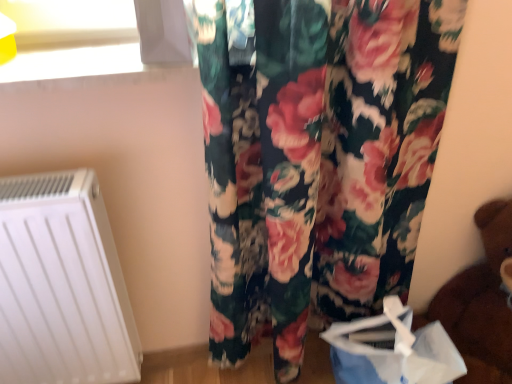
This screenshot has height=384, width=512. I want to click on white matte radiator at lower left, so click(x=62, y=285).

What are the coordinates of `blue paper bag at lower right` in the screenshot? It's located at (392, 350).

Locate an element on the screen. The height and width of the screenshot is (384, 512). white matte radiator at lower left is located at coordinates (62, 285).

Is white matte radiator at lower left positioned beyond the bounds of blue paper bag at lower right?

Absolutely, white matte radiator at lower left is external to blue paper bag at lower right.

How different are the orientations of white matte radiator at lower left and blue paper bag at lower right in degrees?

white matte radiator at lower left and blue paper bag at lower right are facing 1.56e-05 degrees away from each other.

Based on the photo, is white matte radiator at lower left far from blue paper bag at lower right?

They are positioned close to each other.

In the image, is white matte radiator at lower left positioned in front of or behind blue paper bag at lower right?

Visually, white matte radiator at lower left is located in front of blue paper bag at lower right.

From a real-world perspective, is brown plush bear at lower right positioned over white matte radiator at lower left based on gravity?

Actually, brown plush bear at lower right is physically below white matte radiator at lower left in the real world.

Between brown plush bear at lower right and white matte radiator at lower left, which one has larger size?

With larger size is brown plush bear at lower right.

Do you think brown plush bear at lower right is within white matte radiator at lower left, or outside of it?

brown plush bear at lower right is spatially situated outside white matte radiator at lower left.

Which is farther, (460, 308) or (339, 352)?

Point (460, 308)

Considering the sizes of objects brown plush bear at lower right and blue paper bag at lower right in the image provided, who is taller, brown plush bear at lower right or blue paper bag at lower right?

Standing taller between the two is brown plush bear at lower right.

The height and width of the screenshot is (384, 512). Find the location of `shopping bag that is behind the brown plush bear at lower right`. shopping bag that is behind the brown plush bear at lower right is located at coordinates (392, 350).

Considering the relative positions of brown plush bear at lower right and blue paper bag at lower right in the image provided, is brown plush bear at lower right in front of blue paper bag at lower right?

Yes, brown plush bear at lower right is closer to the camera.

From the picture: Is blue paper bag at lower right taller or shorter than brown plush bear at lower right?

Clearly, blue paper bag at lower right is shorter compared to brown plush bear at lower right.

Considering the relative positions of blue paper bag at lower right and brown plush bear at lower right in the image provided, is blue paper bag at lower right to the right of brown plush bear at lower right from the viewer's perspective?

In fact, blue paper bag at lower right is to the left of brown plush bear at lower right.

Is blue paper bag at lower right facing towards brown plush bear at lower right?

No, blue paper bag at lower right is not turned towards brown plush bear at lower right.

Is blue paper bag at lower right further to the viewer compared to brown plush bear at lower right?

Yes, blue paper bag at lower right is behind brown plush bear at lower right.

Would you say white matte radiator at lower left is inside or outside brown plush bear at lower right?

white matte radiator at lower left is spatially situated outside brown plush bear at lower right.

Based on the photo, is white matte radiator at lower left in front of brown plush bear at lower right?

No, white matte radiator at lower left is further to the viewer.

Are white matte radiator at lower left and brown plush bear at lower right far apart?

Indeed, white matte radiator at lower left is not near brown plush bear at lower right.

Which is farther, (68,313) or (508,365)?

Positioned behind is point (508,365).

Can you confirm if blue paper bag at lower right is positioned to the right of white matte radiator at lower left?

Yes, blue paper bag at lower right is to the right of white matte radiator at lower left.

Locate an element on the screen. radiator that is in front of the blue paper bag at lower right is located at coordinates (62, 285).

From the image's perspective, between blue paper bag at lower right and white matte radiator at lower left, who is located below?

blue paper bag at lower right is shown below in the image.

Is blue paper bag at lower right aimed at white matte radiator at lower left?

No, blue paper bag at lower right is not aimed at white matte radiator at lower left.

You are a GUI agent. You are given a task and a screenshot of the screen. Output one action in this format:
    pyautogui.click(x=<x>, y=<y>)
    Task: Click on the radiator that appears on the left of blue paper bag at lower right
    The image size is (512, 384).
    Given the screenshot: What is the action you would take?
    pyautogui.click(x=62, y=285)

This screenshot has height=384, width=512. Identify the location of radiator that is above the brown plush bear at lower right (from the image's perspective). (62, 285).

Which object lies further to the anchor point blue paper bag at lower right, white matte radiator at lower left or brown plush bear at lower right?

white matte radiator at lower left is positioned further to the anchor blue paper bag at lower right.

Looking at the image, which one is located closer to white matte radiator at lower left, blue paper bag at lower right or brown plush bear at lower right?

blue paper bag at lower right is closer to white matte radiator at lower left.

Based on their spatial positions, is blue paper bag at lower right or white matte radiator at lower left further from brown plush bear at lower right?

white matte radiator at lower left lies further to brown plush bear at lower right than the other object.

Estimate the real-world distances between objects in this image. Which object is closer to blue paper bag at lower right, brown plush bear at lower right or white matte radiator at lower left?

brown plush bear at lower right is positioned closer to the anchor blue paper bag at lower right.

Based on their spatial positions, is white matte radiator at lower left or blue paper bag at lower right closer to brown plush bear at lower right?

blue paper bag at lower right is closer to brown plush bear at lower right.

Looking at the image, which one is located further to white matte radiator at lower left, brown plush bear at lower right or blue paper bag at lower right?

Based on the image, brown plush bear at lower right appears to be further to white matte radiator at lower left.

At what (x,y) coordinates should I click in order to perform the action: click on shopping bag between white matte radiator at lower left and brown plush bear at lower right in the horizontal direction. Please return your answer as a coordinate pair (x, y). Image resolution: width=512 pixels, height=384 pixels. Looking at the image, I should click on (392, 350).